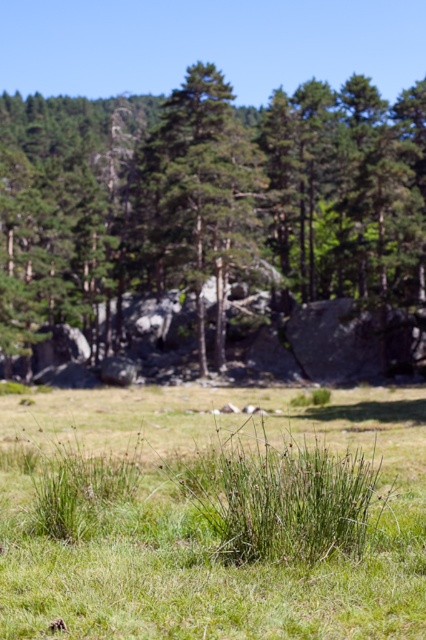
Question: Which point appears closest to the camera in this image?

Choices:
 (A) (66, 163)
 (B) (115, 420)

Answer: (B)

Question: Which point is closer to the camera?

Choices:
 (A) green grass at center
 (B) green leafy tree at center

Answer: (A)

Question: Can you confirm if green leafy tree at center is bigger than green grass at center?

Choices:
 (A) yes
 (B) no

Answer: (A)

Question: Among these points, which one is farthest from the camera?

Choices:
 (A) [405, 400]
 (B) [402, 218]

Answer: (B)

Question: Is green leafy tree at center further to camera compared to green grass at center?

Choices:
 (A) yes
 (B) no

Answer: (A)

Question: Is green leafy tree at center bigger than green grass at center?

Choices:
 (A) yes
 (B) no

Answer: (A)